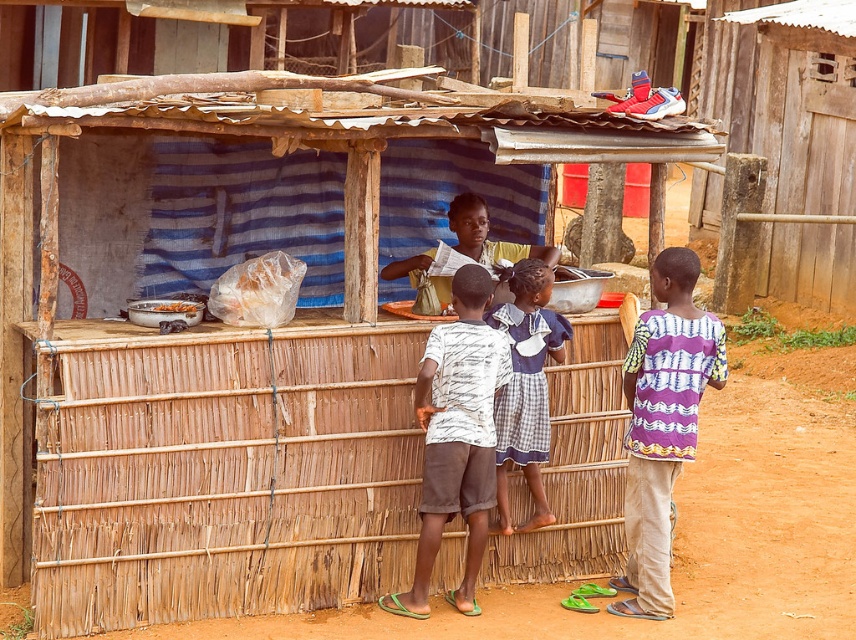
Question: Does white cotton shirt at center appear on the left side of white cotton dress at center?

Choices:
 (A) yes
 (B) no

Answer: (A)

Question: Does white cotton shirt at center appear over white plastic bag at center?

Choices:
 (A) no
 (B) yes

Answer: (A)

Question: Which object appears closest to the camera in this image?

Choices:
 (A) white cotton dress at center
 (B) white plastic bag at center

Answer: (B)

Question: Which object is farther from the camera taking this photo?

Choices:
 (A) white plastic bag at center
 (B) white cotton shirt at center
 (C) purple woven shirt at right

Answer: (A)

Question: Which of the following is the farthest from the observer?

Choices:
 (A) pyautogui.click(x=652, y=502)
 (B) pyautogui.click(x=532, y=364)

Answer: (B)

Question: Does white cotton shirt at center appear on the left side of white plastic bag at center?

Choices:
 (A) yes
 (B) no

Answer: (B)